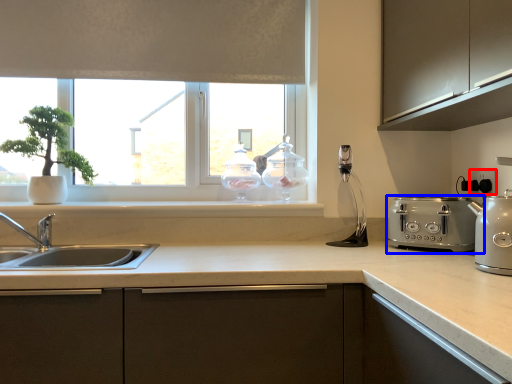
Question: Among these objects, which one is farthest to the camera, electric outlet (highlighted by a red box) or toaster (highlighted by a blue box)?

Choices:
 (A) electric outlet
 (B) toaster

Answer: (A)